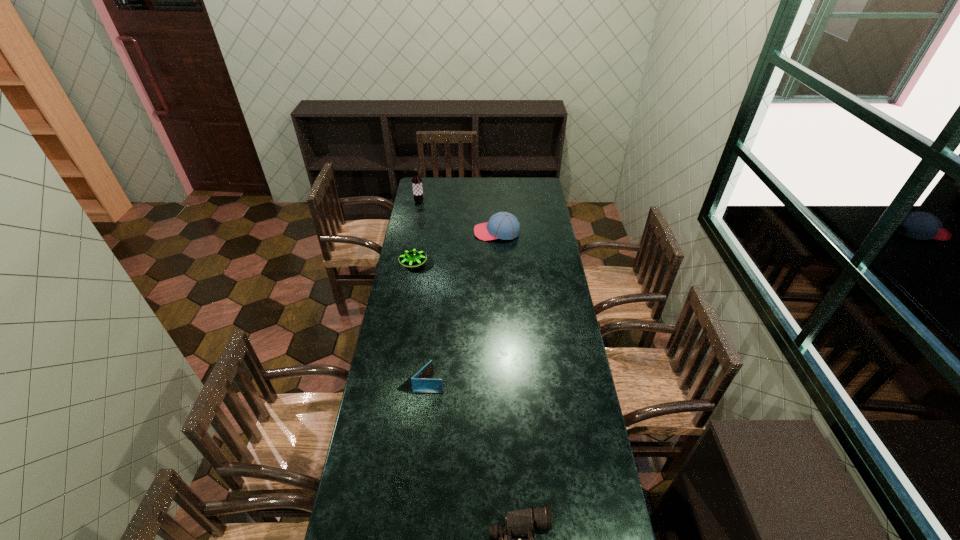
The height and width of the screenshot is (540, 960). I want to click on the tallest object, so click(416, 180).

The width and height of the screenshot is (960, 540). In order to click on root beer in this screenshot , I will do `click(416, 180)`.

I want to click on the fourth nearest object, so click(x=503, y=225).

Where is `the fourth shortest object`? the fourth shortest object is located at coordinates (503, 225).

Image resolution: width=960 pixels, height=540 pixels. I want to click on the third object from left to right, so click(x=422, y=383).

In order to click on the second nearest object in this screenshot , I will do point(422,383).

Where is `the third nearest object`? the third nearest object is located at coordinates (413, 257).

In order to click on vacant space situated on the front of the tallest object in this screenshot , I will do `click(413, 235)`.

Locate an element on the screen. The image size is (960, 540). vacant space positioned 0.190m on the front-facing side of the second farthest object is located at coordinates (440, 232).

You are a GUI agent. You are given a task and a screenshot of the screen. Output one action in this format:
    pyautogui.click(x=<x>, y=<y>)
    Task: Click on the free space located 0.170m on the front-facing side of the second farthest object
    The image size is (960, 540).
    Given the screenshot: What is the action you would take?
    pyautogui.click(x=444, y=232)